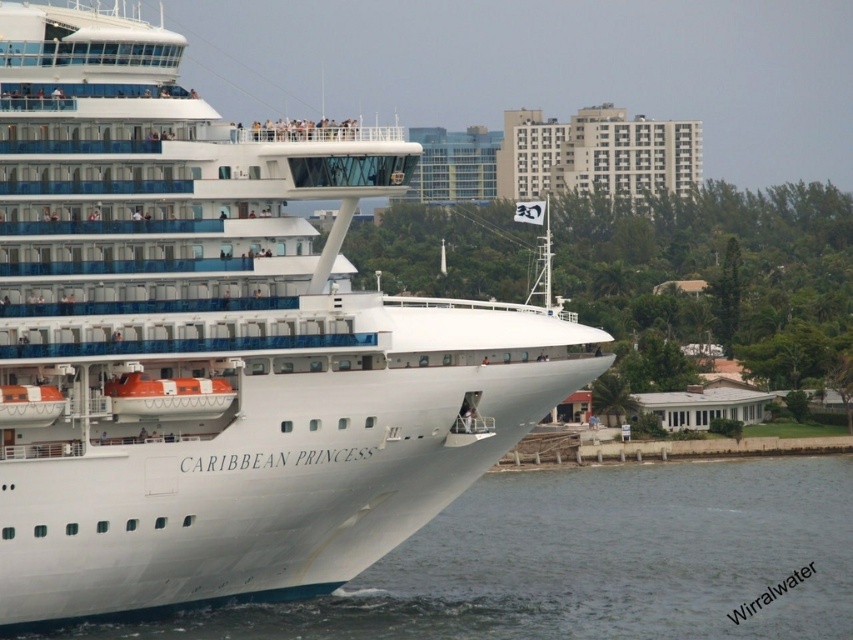
Does white glossy cruise ship at center have a smaller size compared to white water at lower left?

Yes.

Is white glossy cruise ship at center behind white water at lower left?

No, white glossy cruise ship at center is closer to the viewer.

Which is behind, point (123, 97) or point (772, 481)?

The point (772, 481) is behind.

Identify the location of white glossy cruise ship at center. (218, 342).